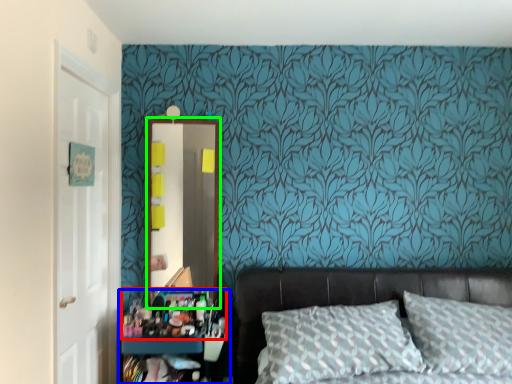
Question: Which object is the closest to the stuff (highlighted by a red box)? Choose among these: dresser (highlighted by a blue box) or mirror (highlighted by a green box).

Choices:
 (A) dresser
 (B) mirror

Answer: (A)